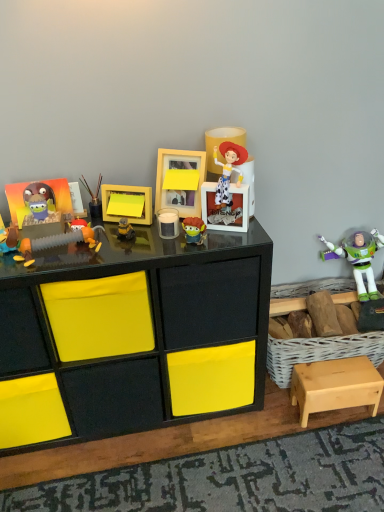
The image size is (384, 512). I want to click on yellow matte picture frame at center, placed as the 2th picture frame when sorted from right to left, so click(128, 192).

What is the approximate width of matte plastic toy at center, the sixth toy viewed from the left?

It is 6.45 centimeters.

Describe the element at coordinates (320, 352) in the screenshot. The image size is (384, 512). I see `white wicker basket at right` at that location.

What do you see at coordinates (335, 386) in the screenshot? I see `light wood step stool at lower right` at bounding box center [335, 386].

I want to click on plush toy at left, which appears as the 6th toy when viewed from the right, so point(58,242).

What is the approximate height of matte plastic toy at left, which is the first toy from left to right?

matte plastic toy at left, which is the first toy from left to right, is 3.87 inches in height.

At what (x,y) coordinates should I click in order to perform the action: click on white plastic buzz lightyear figure at upper right, the first toy when ordered from right to left. Please return your answer as a coordinate pair (x, y). Looking at the image, I should click on (357, 258).

Where is `yellow matte picture frame at center, the first picture frame positioned from the left`? The height and width of the screenshot is (512, 384). yellow matte picture frame at center, the first picture frame positioned from the left is located at coordinates (128, 192).

Does yellow matte toy at center, which is the fifth toy in left-to-right order, turn towards matte plastic toy at left, which is the first toy from left to right?

No, yellow matte toy at center, which is the fifth toy in left-to-right order, is not turned towards matte plastic toy at left, which is the first toy from left to right.

Is point (126, 236) closer or farther from the camera than point (18, 246)?

Clearly, point (126, 236) is more distant from the camera than point (18, 246).

Who is shorter, yellow matte toy at center, the 3th toy in the right-to-left sequence, or matte plastic toy at left, the 7th toy positioned from the right?

yellow matte toy at center, the 3th toy in the right-to-left sequence.

Which object is positioned more to the right, yellow matte toy at center, which is the fifth toy in left-to-right order, or matte plastic toy at left, which is the first toy from left to right?

yellow matte toy at center, which is the fifth toy in left-to-right order.

From a real-world perspective, is black glossy desk at center positioned over yellow matte picture frame at center, placed as the 2th picture frame when sorted from right to left, based on gravity?

No.

Does point (155, 379) come in front of point (138, 192)?

No.

Does black glossy desk at center turn towards yellow matte picture frame at center, placed as the 2th picture frame when sorted from right to left?

No.

Is white wicker basket at right positioned in front of light wood step stool at lower right?

That is False.

Considering the sizes of white wicker basket at right and light wood step stool at lower right in the image, is white wicker basket at right wider or thinner than light wood step stool at lower right?

In the image, white wicker basket at right appears to be wider than light wood step stool at lower right.

From a real-world perspective, between white wicker basket at right and light wood step stool at lower right, who is vertically higher?

From a 3D spatial view, white wicker basket at right is above.

From the image's perspective, is yellow matte picture frame at center, the first picture frame positioned from the left, over matte orange toy at center-left, which ranks as the 5th toy in right-to-left order?

Correct, yellow matte picture frame at center, the first picture frame positioned from the left, appears higher than matte orange toy at center-left, which ranks as the 5th toy in right-to-left order, in the image.

From a real-world perspective, between yellow matte picture frame at center, the first picture frame positioned from the left, and matte orange toy at center-left, which is the third toy from left to right, who is vertically lower?

matte orange toy at center-left, which is the third toy from left to right, from a real-world perspective.

Based on their sizes in the image, would you say yellow matte picture frame at center, the first picture frame positioned from the left, is bigger or smaller than matte orange toy at center-left, which is the third toy from left to right?

yellow matte picture frame at center, the first picture frame positioned from the left, is bigger than matte orange toy at center-left, which is the third toy from left to right.

Can you confirm if white wicker basket at right is positioned to the left of matte orange toy at center-left, which is the third toy from left to right?

No, white wicker basket at right is not to the left of matte orange toy at center-left, which is the third toy from left to right.

Does white wicker basket at right touch matte orange toy at center-left, which ranks as the 5th toy in right-to-left order?

white wicker basket at right and matte orange toy at center-left, which ranks as the 5th toy in right-to-left order, are clearly separated.

Is the position of white wicker basket at right more distant than that of matte orange toy at center-left, which ranks as the 5th toy in right-to-left order?

Yes, the depth of white wicker basket at right is greater than that of matte orange toy at center-left, which ranks as the 5th toy in right-to-left order.

From a real-world perspective, which object rests below the other?

white wicker basket at right, from a real-world perspective.

Which is behind, white plastic buzz lightyear figure at upper right, the first toy when ordered from right to left, or yellow matte picture frame at center, placed as the 2th picture frame when sorted from right to left?

white plastic buzz lightyear figure at upper right, the first toy when ordered from right to left, is more distant.

From the picture: Is white plastic buzz lightyear figure at upper right, placed as the seventh toy when sorted from left to right, positioned beyond the bounds of yellow matte picture frame at center, the first picture frame positioned from the left?

Absolutely, white plastic buzz lightyear figure at upper right, placed as the seventh toy when sorted from left to right, is external to yellow matte picture frame at center, the first picture frame positioned from the left.

Looking at this image, is white plastic buzz lightyear figure at upper right, the first toy when ordered from right to left, at the right side of yellow matte picture frame at center, placed as the 2th picture frame when sorted from right to left?

Indeed, white plastic buzz lightyear figure at upper right, the first toy when ordered from right to left, is positioned on the right side of yellow matte picture frame at center, placed as the 2th picture frame when sorted from right to left.

From the picture: From the image's perspective, is white plastic buzz lightyear figure at upper right, the first toy when ordered from right to left, under yellow matte picture frame at center, placed as the 2th picture frame when sorted from right to left?

Yes, from the image's perspective, white plastic buzz lightyear figure at upper right, the first toy when ordered from right to left, is beneath yellow matte picture frame at center, placed as the 2th picture frame when sorted from right to left.

The width and height of the screenshot is (384, 512). Identify the location of toy that is the 6th one when counting backward from the black glossy desk at center. (93, 198).

Consider the image. Is metallic paintbrushes at center, which is the fourth toy in right-to-left order, surrounding black glossy desk at center?

No, black glossy desk at center is not a part of metallic paintbrushes at center, which is the fourth toy in right-to-left order.

Are metallic paintbrushes at center, which is the fourth toy in right-to-left order, and black glossy desk at center far apart?

No, metallic paintbrushes at center, which is the fourth toy in right-to-left order, is not far away from black glossy desk at center.

I want to click on the 4th toy to the right of the matte plastic toy at left, the 7th toy positioned from the right, counting from the anchor's position, so click(x=125, y=230).

In the image, there is a yellow matte picture frame at center, placed as the 2th picture frame when sorted from right to left. Identify the location of desk below it (from the image's perspective). (139, 327).

From the image, which object appears to be nearer to black glossy desk at center, yellow matte picture frame at center, the first picture frame positioned from the left, or white wicker basket at right?

Based on the image, yellow matte picture frame at center, the first picture frame positioned from the left, appears to be nearer to black glossy desk at center.

In the scene shown: Looking at the image, which one is located further to wooden picture frame at center, which ranks as the 1th picture frame in right-to-left order, metallic paintbrushes at center, which is the fourth toy in right-to-left order, or matte plastic toy at center, the sixth toy viewed from the left?

metallic paintbrushes at center, which is the fourth toy in right-to-left order, is further to wooden picture frame at center, which ranks as the 1th picture frame in right-to-left order.

Estimate the real-world distances between objects in this image. Which object is further from white plastic buzz lightyear figure at upper right, placed as the seventh toy when sorted from left to right, light wood step stool at lower right or matte orange toy at center-left, which ranks as the 5th toy in right-to-left order?

matte orange toy at center-left, which ranks as the 5th toy in right-to-left order, is positioned further to the anchor white plastic buzz lightyear figure at upper right, placed as the seventh toy when sorted from left to right.

Based on their spatial positions, is matte plastic toy at left, the 7th toy positioned from the right, or matte plastic toy at center, the sixth toy viewed from the left, further from metallic paintbrushes at center, which is the fourth toy in right-to-left order?

matte plastic toy at center, the sixth toy viewed from the left.

Based on their spatial positions, is matte plastic toy at left, the 7th toy positioned from the right, or plush toy at left, which appears as the 6th toy when viewed from the right, closer to wooden picture frame at center, which ranks as the 1th picture frame in right-to-left order?

plush toy at left, which appears as the 6th toy when viewed from the right.

In the scene shown: Looking at the image, which one is located further to yellow matte picture frame at center, placed as the 2th picture frame when sorted from right to left, matte orange toy at center-left, which ranks as the 5th toy in right-to-left order, or wooden picture frame at center, which ranks as the 1th picture frame in right-to-left order?

matte orange toy at center-left, which ranks as the 5th toy in right-to-left order, lies further to yellow matte picture frame at center, placed as the 2th picture frame when sorted from right to left, than the other object.

Estimate the real-world distances between objects in this image. Which object is closer to matte plastic toy at center, the sixth toy viewed from the left, light wood step stool at lower right or wooden picture frame at center, which is the second picture frame from left to right?

wooden picture frame at center, which is the second picture frame from left to right, is positioned closer to the anchor matte plastic toy at center, the sixth toy viewed from the left.

Considering their positions, is matte plastic toy at left, which is the first toy from left to right, positioned further to plush toy at left, arranged as the second toy when viewed from the left, than yellow matte toy at center, the 3th toy in the right-to-left sequence?

The object further to plush toy at left, arranged as the second toy when viewed from the left, is yellow matte toy at center, the 3th toy in the right-to-left sequence.

What are the coordinates of `toy situated between wooden picture frame at center, which is the second picture frame from left to right, and white plastic buzz lightyear figure at upper right, placed as the seventh toy when sorted from left to right, from left to right` in the screenshot? It's located at (193, 230).

Find the location of a particular element. picture frame between plush toy at left, which appears as the 6th toy when viewed from the right, and wooden picture frame at center, which ranks as the 1th picture frame in right-to-left order is located at coordinates (128, 192).

Find the location of `desk between plush toy at left, which appears as the 6th toy when viewed from the right, and white wicker basket at right from left to right`. desk between plush toy at left, which appears as the 6th toy when viewed from the right, and white wicker basket at right from left to right is located at coordinates (139, 327).

Identify the location of picture frame between yellow matte picture frame at center, placed as the 2th picture frame when sorted from right to left, and matte plastic toy at center, the 2th toy viewed from the right, from left to right. The image size is (384, 512). (180, 180).